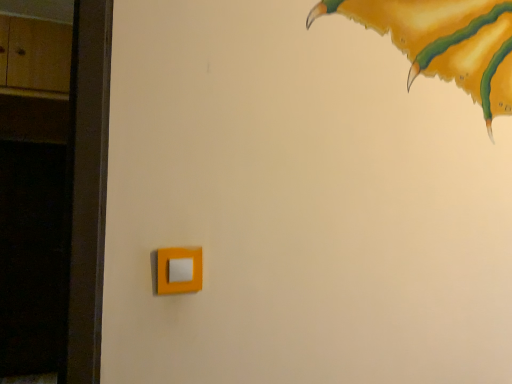
The image size is (512, 384). What do you see at coordinates (179, 270) in the screenshot?
I see `matte white switch at lower center` at bounding box center [179, 270].

At what (x,y) coordinates should I click in order to perform the action: click on matte white switch at lower center. Please return your answer as a coordinate pair (x, y). This screenshot has height=384, width=512. Looking at the image, I should click on (179, 270).

Measure the distance between matte white switch at lower center and camera.

The depth of matte white switch at lower center is 82.50 centimeters.

Image resolution: width=512 pixels, height=384 pixels. What are the coordinates of `matte white switch at lower center` in the screenshot? It's located at (179, 270).